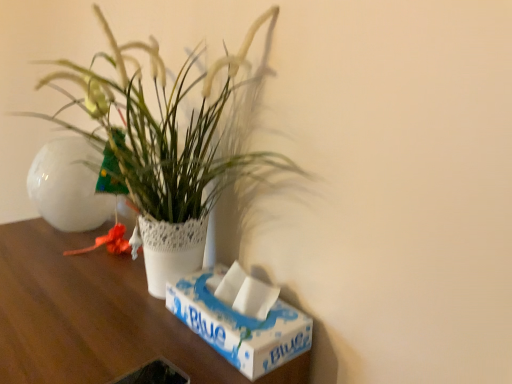
Locate an element on the screen. vacant space situated on the left part of white lace pot at center is located at coordinates (53, 278).